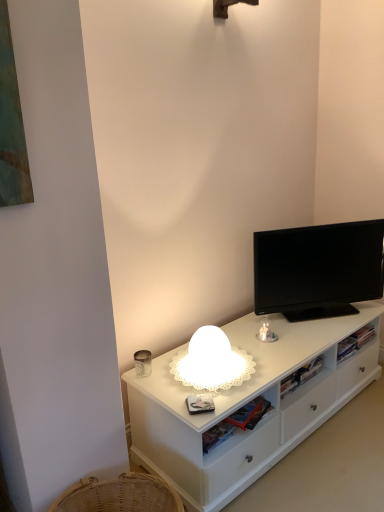
Question: Considering the positions of black glossy tv at upper right and white frosted glass lamp at center in the image, is black glossy tv at upper right taller or shorter than white frosted glass lamp at center?

Choices:
 (A) short
 (B) tall

Answer: (B)

Question: In the image, is black glossy tv at upper right on the left side or the right side of white frosted glass lamp at center?

Choices:
 (A) left
 (B) right

Answer: (B)

Question: Estimate the real-world distances between objects in this image. Which object is farther from the black glossy tv at upper right?

Choices:
 (A) white matte cabinet at center
 (B) white frosted glass lamp at center

Answer: (B)

Question: Which of these objects is positioned closest to the black glossy tv at upper right?

Choices:
 (A) white matte cabinet at center
 (B) white frosted glass lamp at center

Answer: (A)